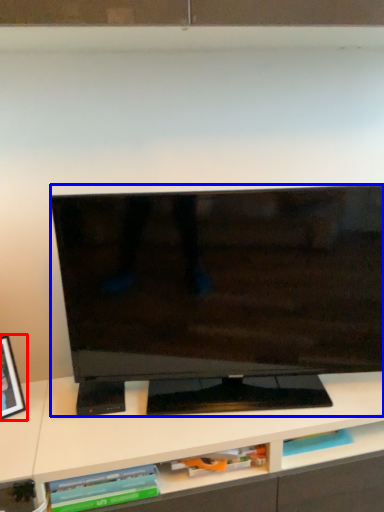
Question: Which object appears farthest to the camera in this image, picture frame (highlighted by a red box) or television (highlighted by a blue box)?

Choices:
 (A) picture frame
 (B) television

Answer: (B)